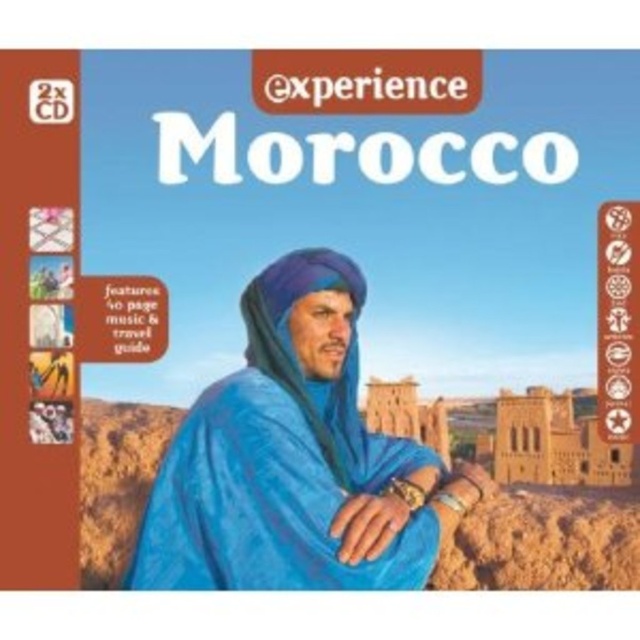
Is the position of blue velvet robe at center more distant than that of blue fabric headscarf at center?

That is False.

Which is more to the left, blue velvet robe at center or blue fabric headscarf at center?

From the viewer's perspective, blue velvet robe at center appears more on the left side.

Between point (243, 547) and point (362, 436), which one is positioned in front?

Point (243, 547) is more forward.

This screenshot has width=640, height=640. In order to click on blue velvet robe at center in this screenshot , I will do `click(288, 458)`.